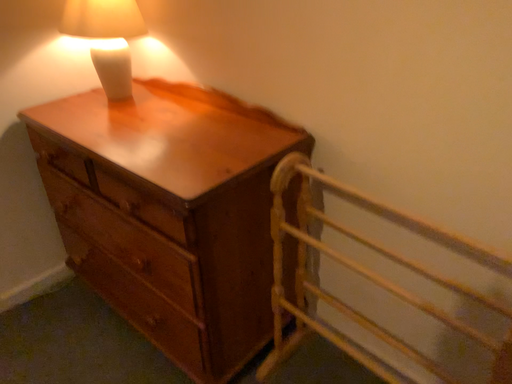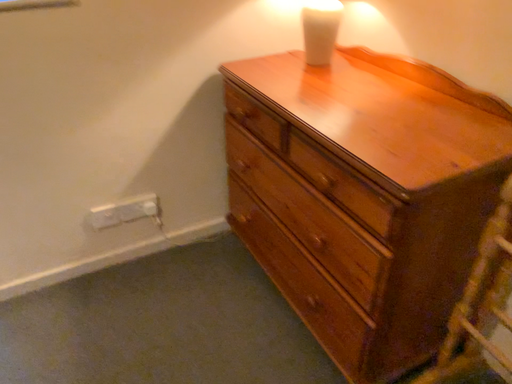
Question: Which way did the camera rotate in the video?

Choices:
 (A) rotated left
 (B) rotated right

Answer: (A)